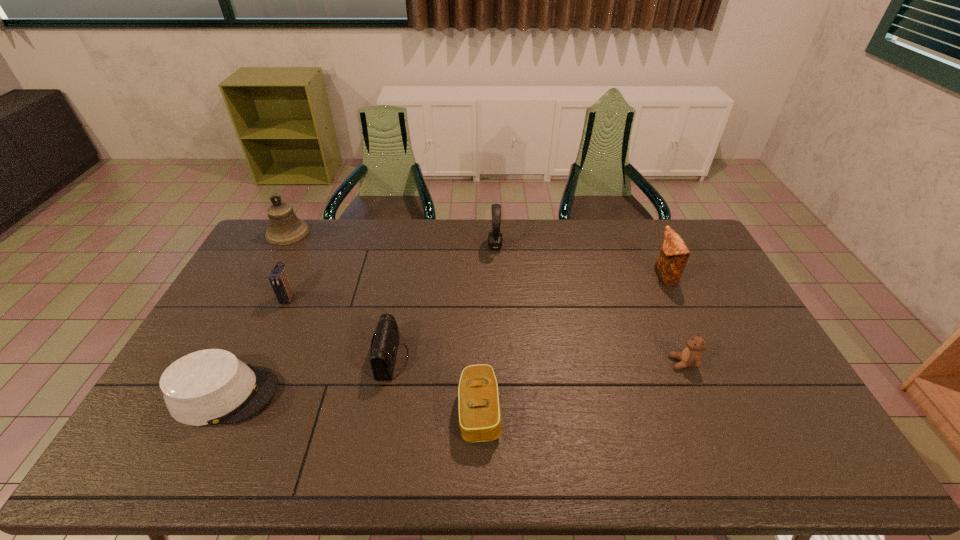
Where is `bell`? Image resolution: width=960 pixels, height=540 pixels. bell is located at coordinates (285, 228).

Find the location of `headset`. headset is located at coordinates (495, 239).

Image resolution: width=960 pixels, height=540 pixels. Identify the location of the rightmost clutch bag. tap(673, 256).

In order to click on the fifth shortest object in this screenshot , I will do `click(278, 278)`.

Where is `the third shortest clutch bag`? The width and height of the screenshot is (960, 540). the third shortest clutch bag is located at coordinates (278, 278).

This screenshot has height=540, width=960. I want to click on teddy bear, so click(691, 356).

Identify the location of the fourth object from left to right. (384, 345).

In order to click on hat in this screenshot , I will do click(212, 386).

The width and height of the screenshot is (960, 540). Find the location of `the second clutch bag from right to left`. the second clutch bag from right to left is located at coordinates (479, 406).

Locate an element on the screen. The width and height of the screenshot is (960, 540). vacant area situated 0.090m on the right of the bell is located at coordinates (332, 233).